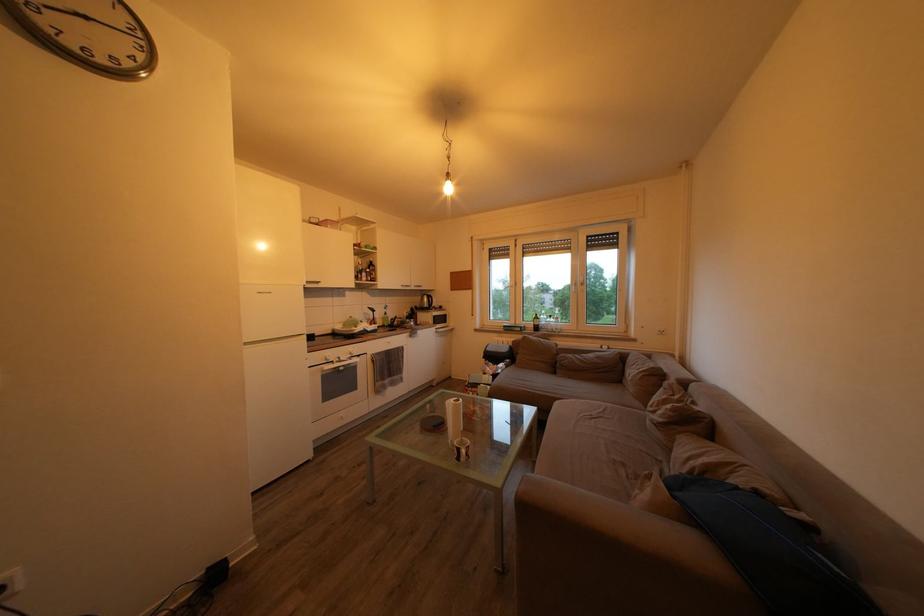
Find the location of a particular element. The height and width of the screenshot is (616, 924). oven knob is located at coordinates (329, 359).